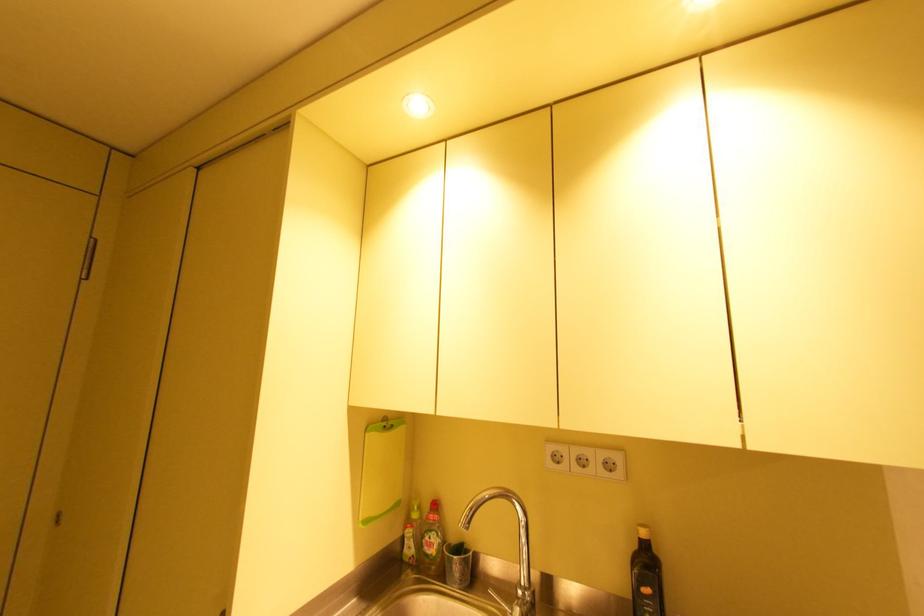
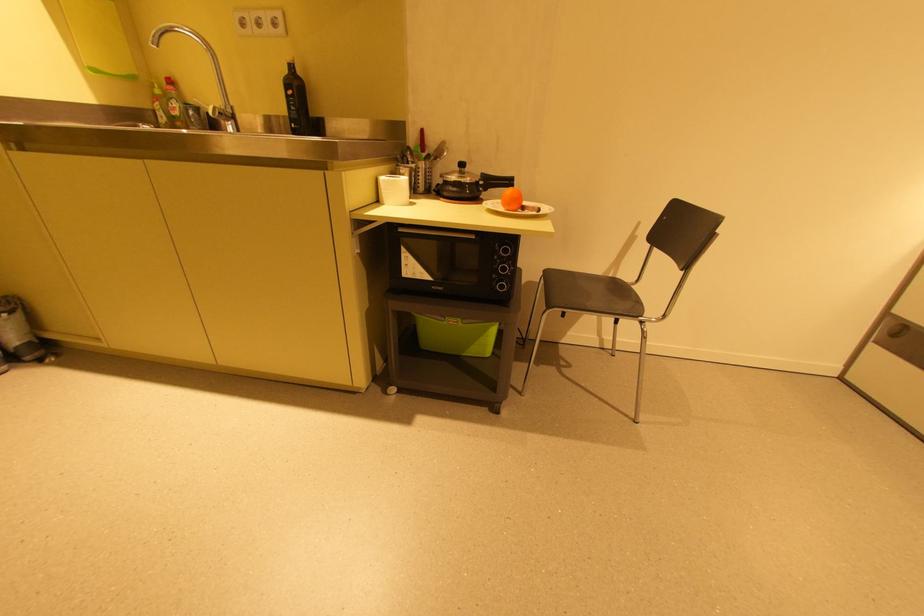
Locate, in the second image, the point that corresponds to (555,448) in the first image.

(242, 17)